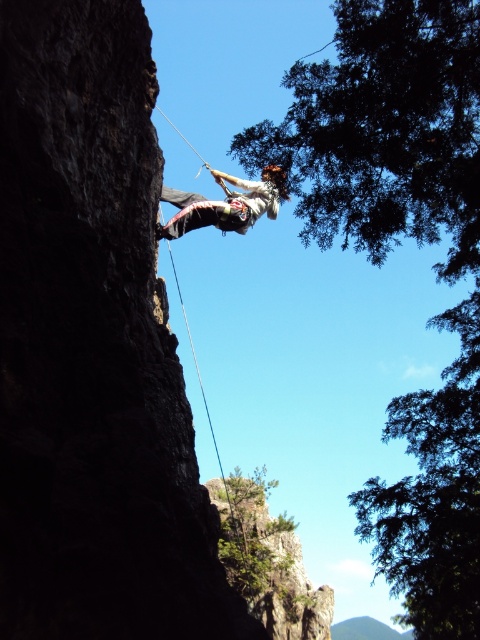
You are a hiker planning to climb the cliff. You see the green leafy tree at upper right and the white climbing harness at center. Which object is higher up in the scene?

The green leafy tree at upper right is much taller than the white climbing harness at center, so the green leafy tree at upper right is higher up in the scene.

You are a safety officer assessing the climber. The climber is at point (399, 554). The camera is positioned at a certain distance. Can you determine if the climber is within the safe rappelling distance of 20 meters from the camera?

The distance between point (399, 554) and the camera is 18.13 meters, which is within the safe rappelling distance of 20 meters. Therefore, the climber is at a safe distance.